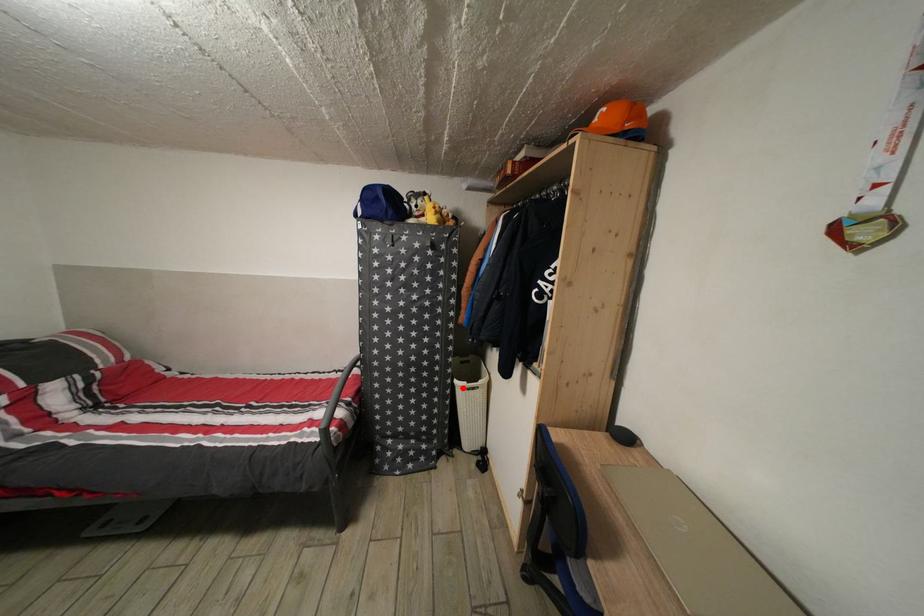
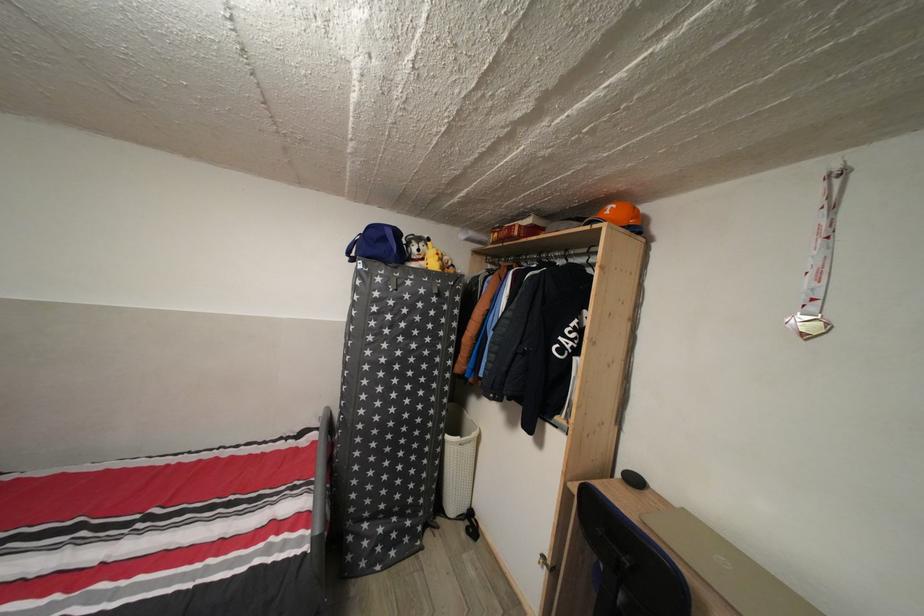
Find the pixel in the second image that matches the highlighted location in the first image.

(455, 444)